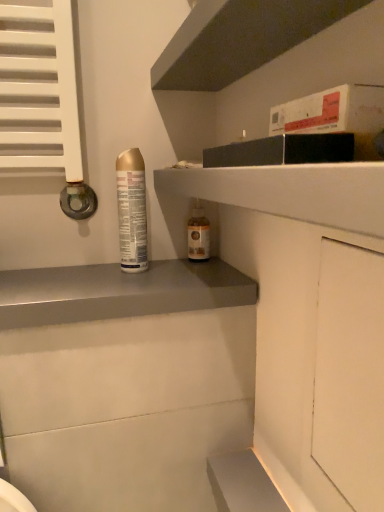
Identify the location of vacant space in front of gold metallic can at left, which ranks as the first bottle in front-to-back order. This screenshot has height=512, width=384. (114, 287).